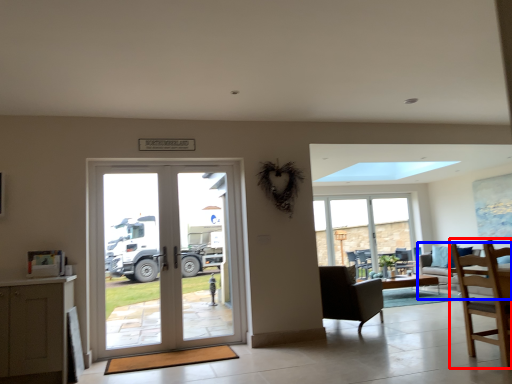
Question: Which object appears farthest to the camera in this image, chair (highlighted by a red box) or studio couch (highlighted by a blue box)?

Choices:
 (A) chair
 (B) studio couch

Answer: (B)